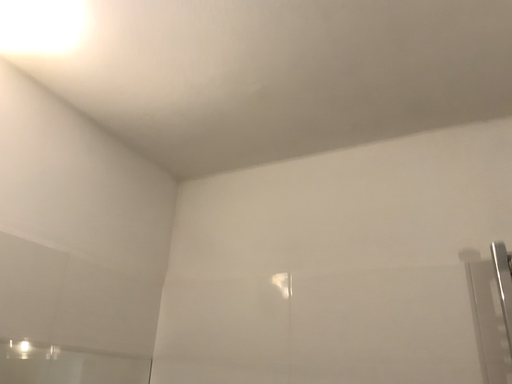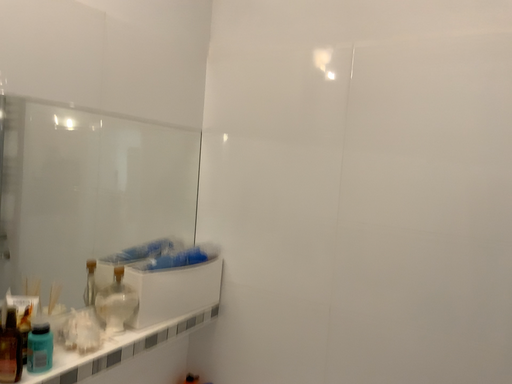
Question: Which way did the camera rotate in the video?

Choices:
 (A) rotated downward
 (B) rotated upward

Answer: (A)